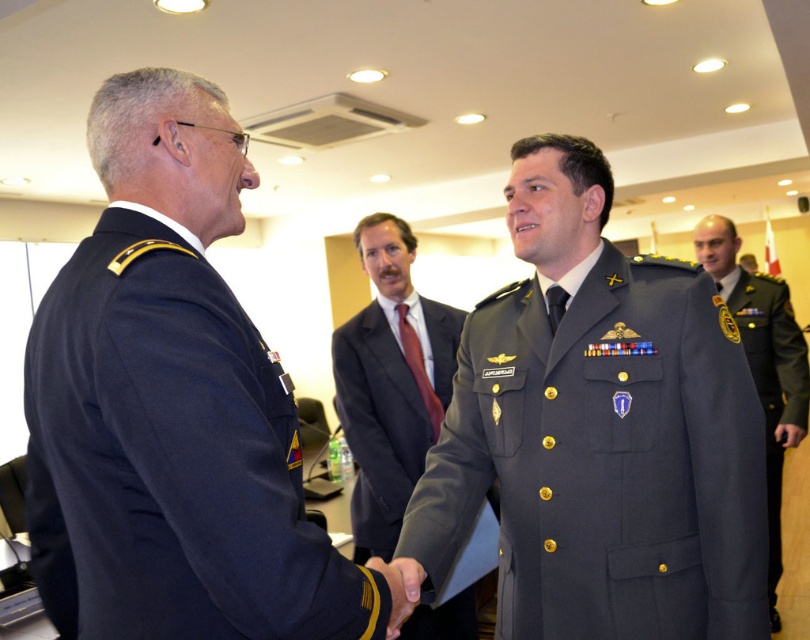
Question: Which object is positioned closest to the matte gray uniform at center?

Choices:
 (A) navy blue uniform at center
 (B) dark gray uniform at center
 (C) dark gray suit at center

Answer: (A)

Question: Among these objects, which one is nearest to the camera?

Choices:
 (A) dark gray suit at center
 (B) dark gray uniform at center

Answer: (A)

Question: Considering the relative positions of matte gray uniform at center and dark gray suit at center in the image provided, where is matte gray uniform at center located with respect to dark gray suit at center?

Choices:
 (A) left
 (B) right

Answer: (B)

Question: Can you confirm if matte gray uniform at center is positioned above dark gray uniform at center?

Choices:
 (A) yes
 (B) no

Answer: (A)

Question: Is navy blue uniform at center behind matte gray uniform at center?

Choices:
 (A) no
 (B) yes

Answer: (A)

Question: Which of the following is the farthest from the observer?

Choices:
 (A) (245, 481)
 (B) (715, 244)
 (C) (425, 449)
 (D) (736, 632)

Answer: (B)